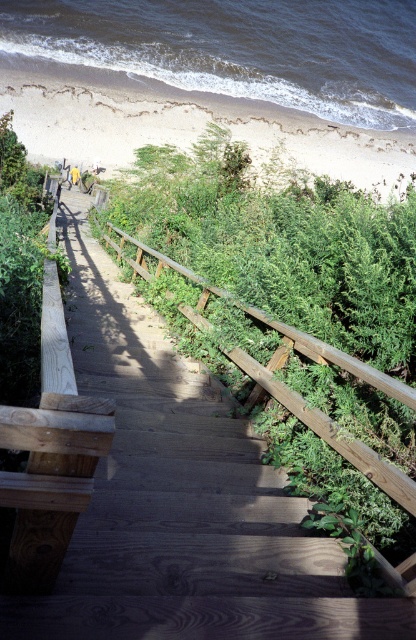
You are standing at the top of the staircase and want to see the ocean. Which object, the white sandy beach at upper left or the wooden rail at center, is closer to your line of sight?

The white sandy beach at upper left is taller than the wooden rail at center, so the white sandy beach at upper left is closer to your line of sight.

You are standing at the bottom of the wooden staircase and want to reach the white sandy beach at upper left. Based on the coordinates provided, is the beach to your left or right side?

The white sandy beach at upper left is located at point 0.194 on the x and 0.442 on the y, which means it is positioned to the left side from your current position at the bottom of the staircase.